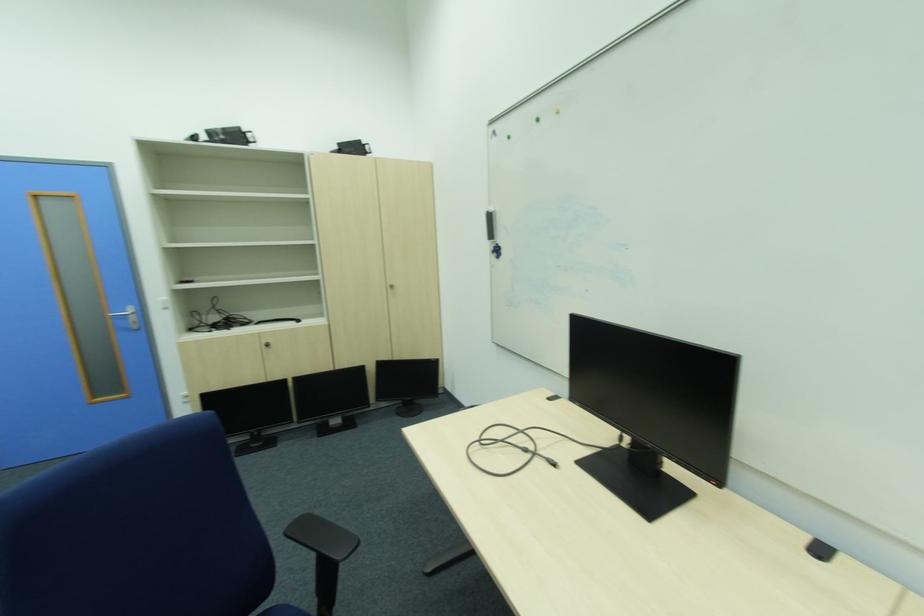
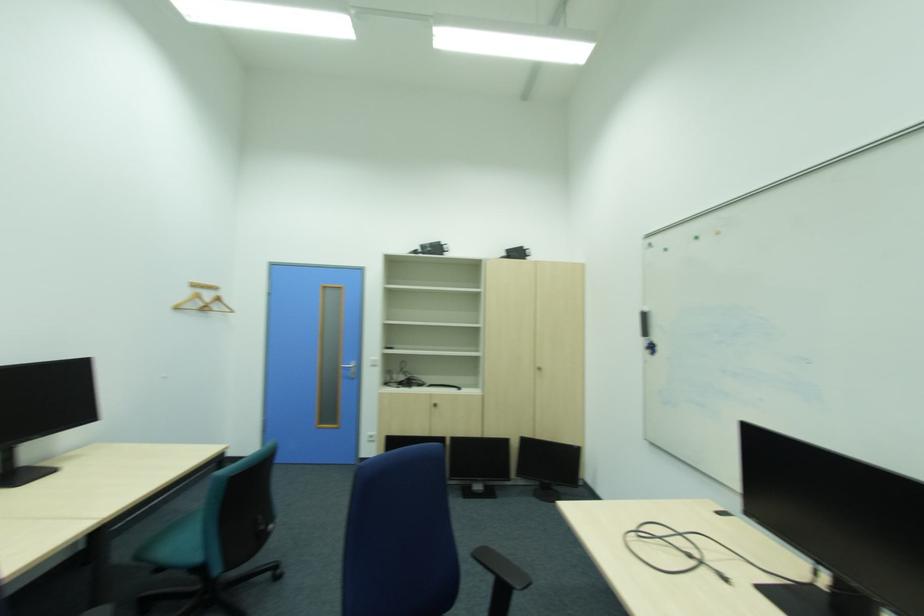
Locate, in the second image, the point that corresponds to (x=290, y=540) in the first image.

(478, 559)